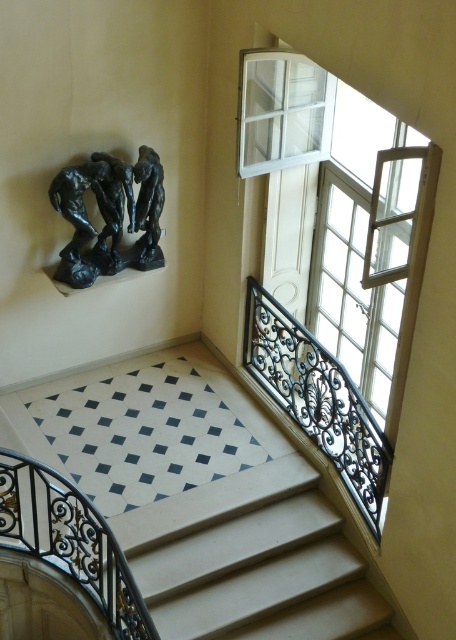
Between point (295, 397) and point (96, 554), which one is positioned in front?

Positioned in front is point (96, 554).

Based on the photo, is black wrought iron balustrade at upper right to the right of black wrought iron balustrade at lower left from the viewer's perspective?

Correct, you'll find black wrought iron balustrade at upper right to the right of black wrought iron balustrade at lower left.

Does point (248, 342) lie behind point (40, 476)?

Yes, point (248, 342) is behind point (40, 476).

Identify the location of black wrought iron balustrade at upper right. (316, 397).

Looking at this image, is clear glass window at upper right behind bronze statue at upper left?

No, it is in front of bronze statue at upper left.

Between point (263, 99) and point (153, 220), which one is positioned behind?

Positioned behind is point (153, 220).

Locate an element on the screen. This screenshot has height=640, width=456. clear glass window at upper right is located at coordinates (337, 268).

Between clear glass window at upper right and smooth beige stairs at center, which one has less height?

smooth beige stairs at center is shorter.

Looking at this image, can you confirm if clear glass window at upper right is thinner than smooth beige stairs at center?

Correct, clear glass window at upper right's width is less than smooth beige stairs at center's.

Image resolution: width=456 pixels, height=640 pixels. I want to click on clear glass window at upper right, so click(337, 268).

Where is `clear glass window at upper right`? Image resolution: width=456 pixels, height=640 pixels. clear glass window at upper right is located at coordinates (337, 268).